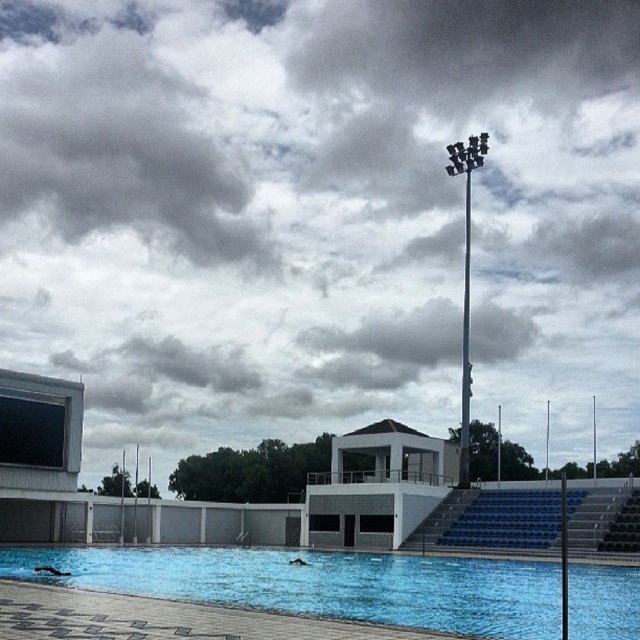
Question: Considering the real-world distances, which object is farthest from the silver metallic pole at upper center?

Choices:
 (A) metallic pole at center-right
 (B) blue smooth water at center

Answer: (A)

Question: In this image, where is blue smooth water at center located relative to silver metallic pole at upper center?

Choices:
 (A) above
 (B) below

Answer: (B)

Question: Which of these objects is positioned farthest from the blue smooth water at center?

Choices:
 (A) metallic pole at center-right
 (B) silver metallic pole at upper center

Answer: (B)

Question: Does silver metallic pole at upper center have a lesser width compared to metallic pole at center-right?

Choices:
 (A) yes
 (B) no

Answer: (B)

Question: Is blue smooth water at center closer to camera compared to silver metallic pole at upper center?

Choices:
 (A) no
 (B) yes

Answer: (B)

Question: Which point is closer to the camera?

Choices:
 (A) metallic pole at center-right
 (B) silver metallic pole at upper center

Answer: (A)